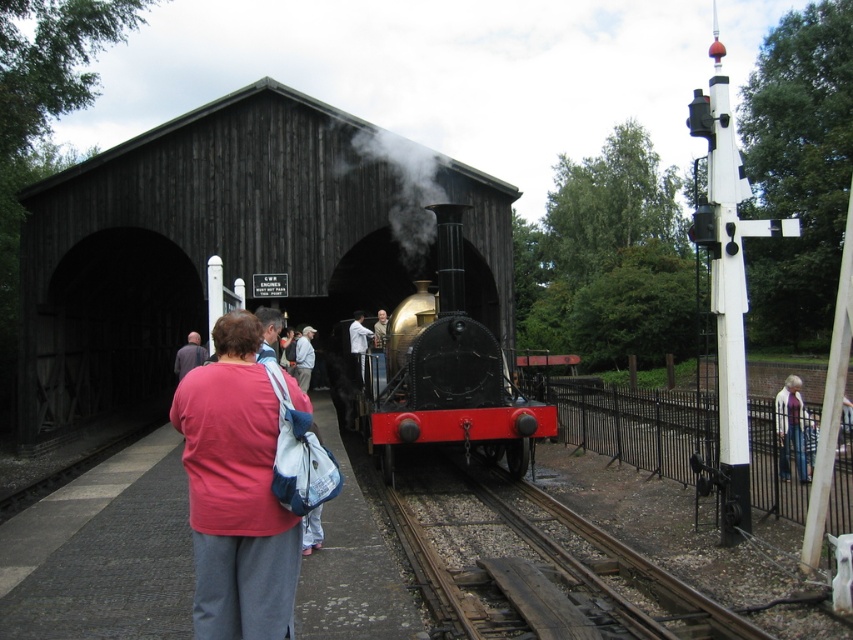
Question: Among these points, which one is farthest from the camera?

Choices:
 (A) (395, 220)
 (B) (437, 618)
 (C) (189, 365)
 (D) (393, 316)

Answer: (A)

Question: Which point is closer to the camera taking this photo?

Choices:
 (A) (354, 317)
 (B) (409, 209)
 (C) (448, 305)
 (D) (306, 333)

Answer: (C)

Question: Considering the relative positions of smooth metal train track at center and polished brass steam engine at center in the image provided, where is smooth metal train track at center located with respect to polished brass steam engine at center?

Choices:
 (A) above
 (B) below

Answer: (B)

Question: Can you confirm if polished brass steam engine at center is positioned to the left of black smoke at center?

Choices:
 (A) no
 (B) yes

Answer: (A)

Question: Can you confirm if black smoke at center is thinner than white shirt at center?

Choices:
 (A) no
 (B) yes

Answer: (B)

Question: Estimate the real-world distances between objects in this image. Which object is farther from the smooth metal train track at center?

Choices:
 (A) light blue denim jacket at center
 (B) matte pink shirt at center
 (C) light brown leather jacket at center
 (D) white shirt at center

Answer: (A)